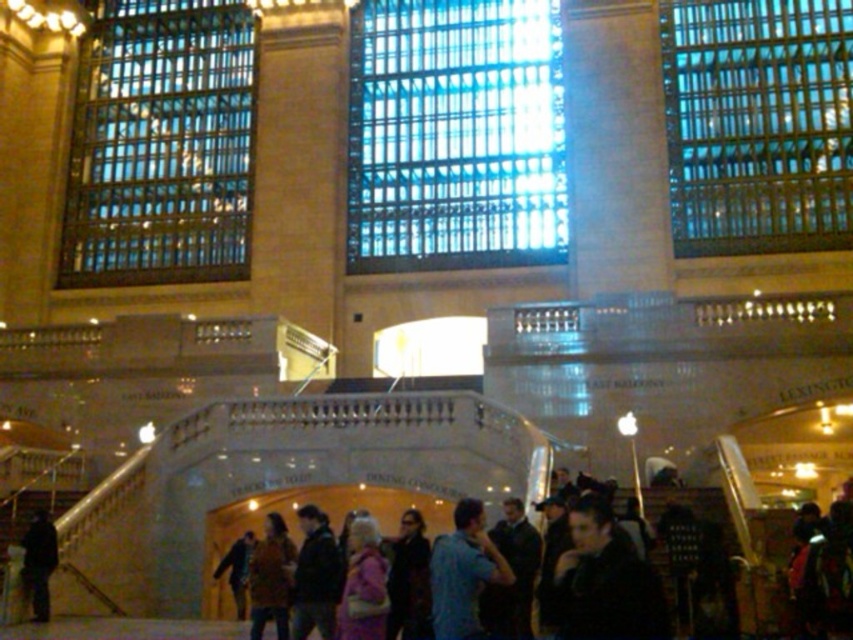
Who is higher up, dark brown leather jacket at center or dark blue jacket at lower left?

dark brown leather jacket at center is higher up.

Consider the image. Does dark brown leather jacket at center appear under dark blue jacket at lower left?

No, dark brown leather jacket at center is not below dark blue jacket at lower left.

Where is `dark brown leather jacket at center`? This screenshot has width=853, height=640. dark brown leather jacket at center is located at coordinates (315, 577).

Find the location of a particular element. The image size is (853, 640). dark brown leather jacket at center is located at coordinates (315, 577).

Is the position of dark hair at lower right less distant than that of pink fabric jacket at center?

Yes, dark hair at lower right is in front of pink fabric jacket at center.

This screenshot has width=853, height=640. Describe the element at coordinates (605, 580) in the screenshot. I see `dark hair at lower right` at that location.

I want to click on dark hair at lower right, so coord(605,580).

The image size is (853, 640). Describe the element at coordinates (463, 572) in the screenshot. I see `blue cotton shirt at center` at that location.

Identify the location of blue cotton shirt at center. (463, 572).